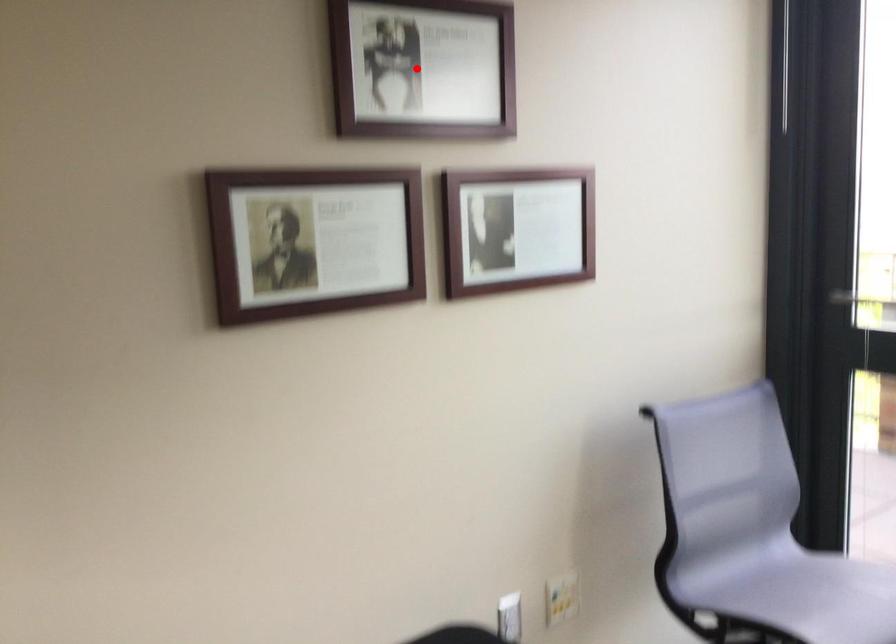
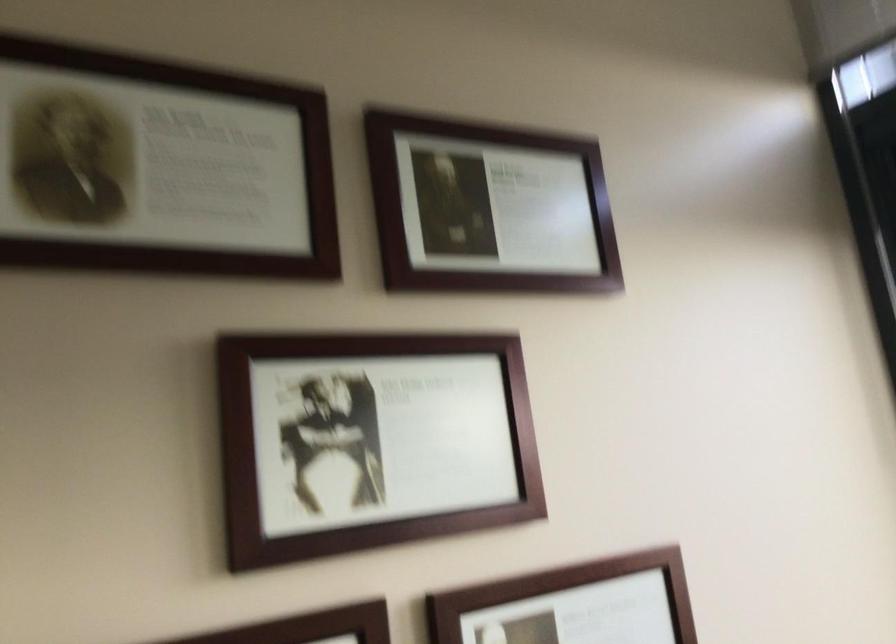
Question: I am providing you with two images of the same scene from different viewpoints. A red point is shown in image1. For the corresponding object point in image2, is it positioned nearer or farther from the camera?

Choices:
 (A) Nearer
 (B) Farther

Answer: (A)